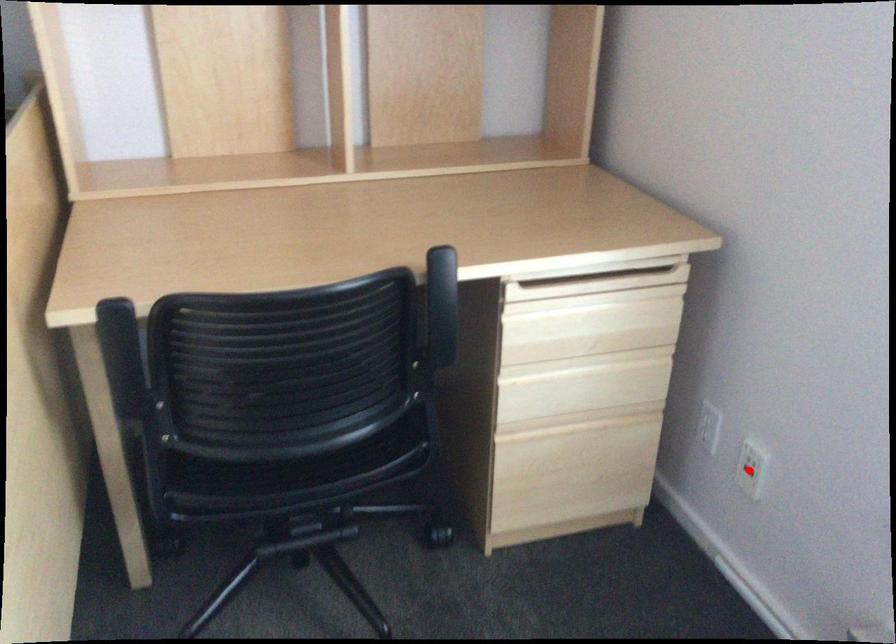
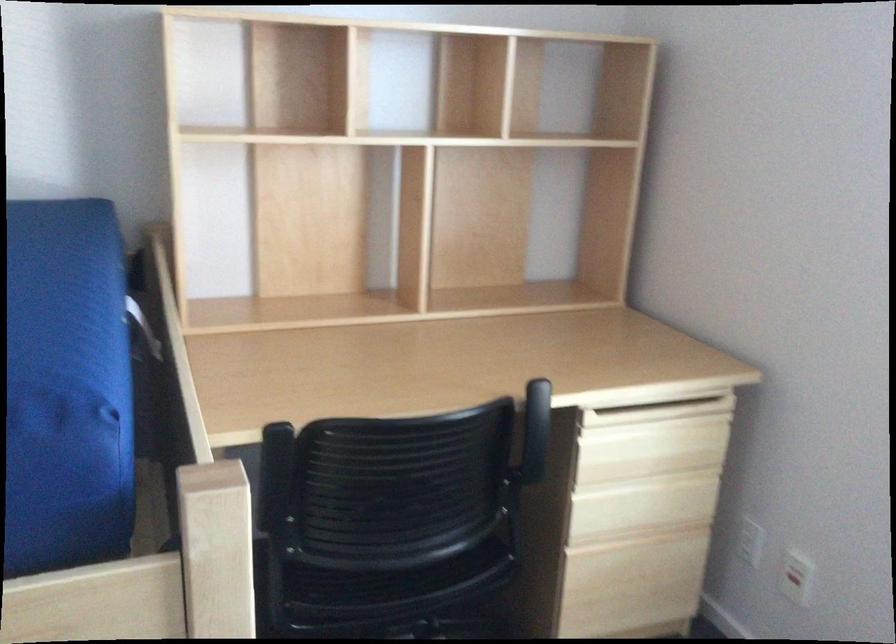
Question: I am providing you with two images of the same scene from different viewpoints. Image1 has a red point marked. In image2, the corresponding 3D location appears at what relative position? Reply with the corresponding letter.

Choices:
 (A) Closer
 (B) Farther

Answer: (B)